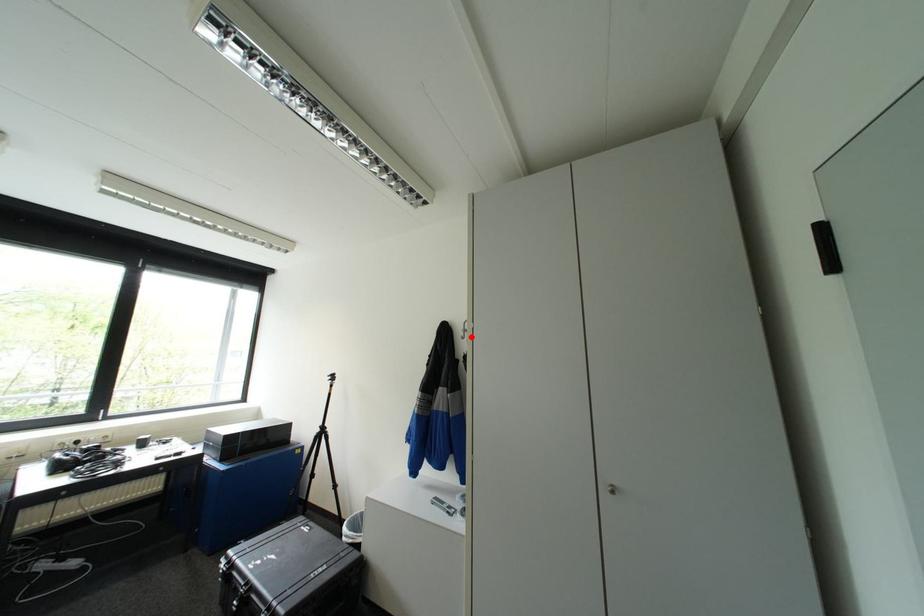
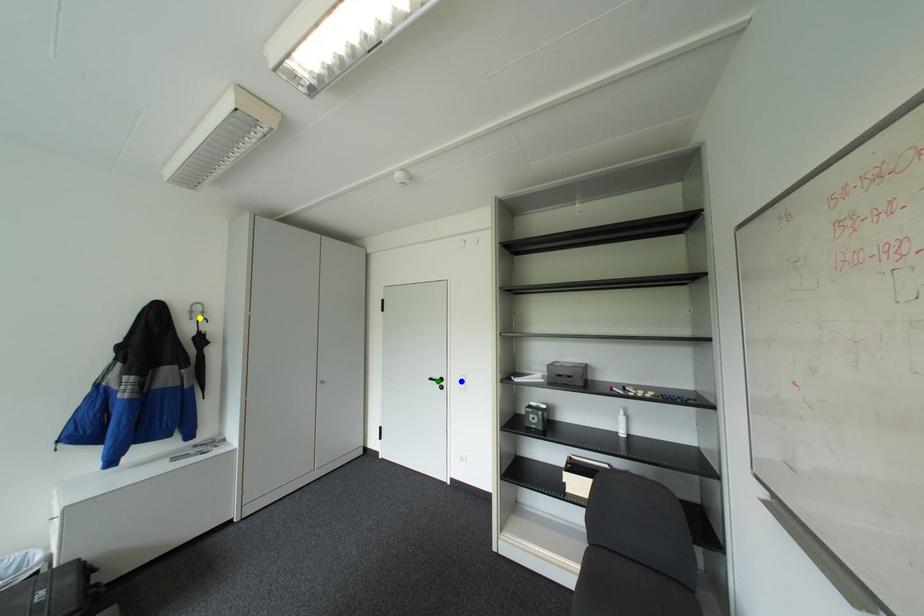
Question: I am providing you with two images of the same scene from different viewpoints. A red point is marked on the first image. You are given multiple points on the second image. Can you choose the point in image 2 that corresponds to the point in image 1?

Choices:
 (A) yellow point
 (B) green point
 (C) blue point

Answer: (A)